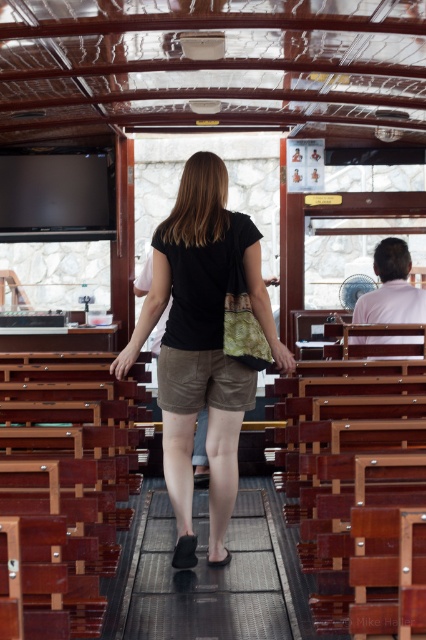
You are a passenger on a boat and you see the black matte shorts at center and the black rubber mat at center. Which one is located to the left?

The black matte shorts at center is positioned on the left side of black rubber mat at center, so the black matte shorts at center is located to the left.

You are standing in the boat and need to place a 2.5 feet long object between the black matte shorts at center and the black rubber mat at center. Is there enough space?

The black matte shorts at center is 3.41 feet away from the black rubber mat at center. Since the object is 2.5 feet long, there is enough space to place it between them.

You are standing at the back of the boat and want to reach the exit located at point (199, 516). There is an obstacle at point (112, 369). Will you have to go around the obstacle to reach the exit?

Point (112, 369) is in front of point (199, 516), so the obstacle at point (112, 369) is blocking the path to the exit at point (199, 516). Therefore, you will need to go around the obstacle to reach the exit.